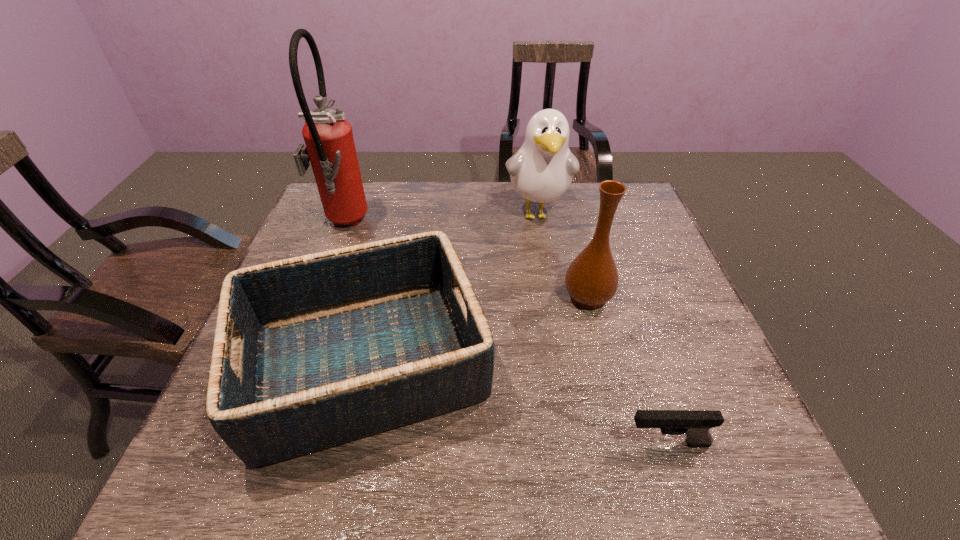
Where is `vacant position located 0.370m on the front-facing side of the pistol`? This screenshot has width=960, height=540. vacant position located 0.370m on the front-facing side of the pistol is located at coordinates (425, 443).

Find the location of a particular element. vacant region located on the front-facing side of the pistol is located at coordinates click(x=468, y=443).

Where is `fire extinguisher that is at the far edge`? The width and height of the screenshot is (960, 540). fire extinguisher that is at the far edge is located at coordinates 330,147.

Locate an element on the screen. The image size is (960, 540). gull located at the far edge is located at coordinates (541, 171).

You are a GUI agent. You are given a task and a screenshot of the screen. Output one action in this format:
    pyautogui.click(x=<x>, y=<y>)
    Task: Click on the basket situated at the near edge
    
    Given the screenshot: What is the action you would take?
    pyautogui.click(x=326, y=348)

What are the coordinates of `pistol that is at the near edge` in the screenshot? It's located at (695, 424).

Where is `fire extinguisher positioned at the left edge`? This screenshot has height=540, width=960. fire extinguisher positioned at the left edge is located at coordinates (330, 147).

Where is `basket that is at the left edge`? The image size is (960, 540). basket that is at the left edge is located at coordinates (326, 348).

Locate an element on the screen. object located in the right edge section of the desktop is located at coordinates (695, 424).

Find the location of a particular element. The image size is (960, 540). object that is at the far left corner is located at coordinates (330, 147).